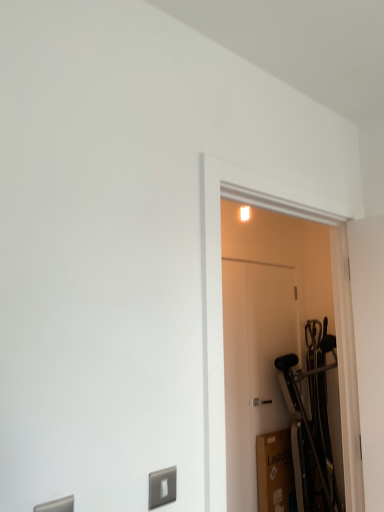
Question: Which direction should I rotate to face white matte door at center, acting as the first door starting from the front, — up or down?

Choices:
 (A) up
 (B) down

Answer: (B)

Question: Can you confirm if white matte door at center, acting as the first door starting from the front, is bigger than white matte door at center, the first door viewed from the back?

Choices:
 (A) yes
 (B) no

Answer: (A)

Question: Is white matte door at center, acting as the second door starting from the back, located outside white matte door at center, the first door viewed from the back?

Choices:
 (A) yes
 (B) no

Answer: (A)

Question: From the image's perspective, is white matte door at center, acting as the second door starting from the back, over white matte door at center, the first door viewed from the back?

Choices:
 (A) no
 (B) yes

Answer: (B)

Question: From a real-world perspective, is white matte door at center, acting as the first door starting from the front, physically below white matte door at center, the first door viewed from the back?

Choices:
 (A) no
 (B) yes

Answer: (A)

Question: Is there a large distance between white matte door at center, acting as the second door starting from the back, and white matte door at center, the first door viewed from the back?

Choices:
 (A) yes
 (B) no

Answer: (B)

Question: Is white matte door at center, acting as the second door starting from the back, facing towards white matte door at center, the 2th door viewed from the front?

Choices:
 (A) no
 (B) yes

Answer: (A)

Question: Is white matte door at center, the first door viewed from the back, completely or partially outside of white matte door at center, acting as the second door starting from the back?

Choices:
 (A) yes
 (B) no

Answer: (A)

Question: Can you confirm if white matte door at center, the first door viewed from the back, is smaller than white matte door at center, acting as the first door starting from the front?

Choices:
 (A) yes
 (B) no

Answer: (A)

Question: Is white matte door at center, the first door viewed from the back, positioned with its back to white matte door at center, acting as the first door starting from the front?

Choices:
 (A) no
 (B) yes

Answer: (A)

Question: Can you confirm if white matte door at center, the 2th door viewed from the front, is shorter than white matte door at center, acting as the first door starting from the front?

Choices:
 (A) yes
 (B) no

Answer: (B)

Question: Is white matte door at center, the first door viewed from the back, thinner than white matte door at center, acting as the second door starting from the back?

Choices:
 (A) no
 (B) yes

Answer: (B)

Question: Is white matte door at center, the 2th door viewed from the front, aimed at white matte door at center, acting as the first door starting from the front?

Choices:
 (A) no
 (B) yes

Answer: (A)

Question: Is white matte door at center, the 2th door viewed from the front, situated inside white matte door at center, acting as the first door starting from the front, or outside?

Choices:
 (A) outside
 (B) inside

Answer: (A)